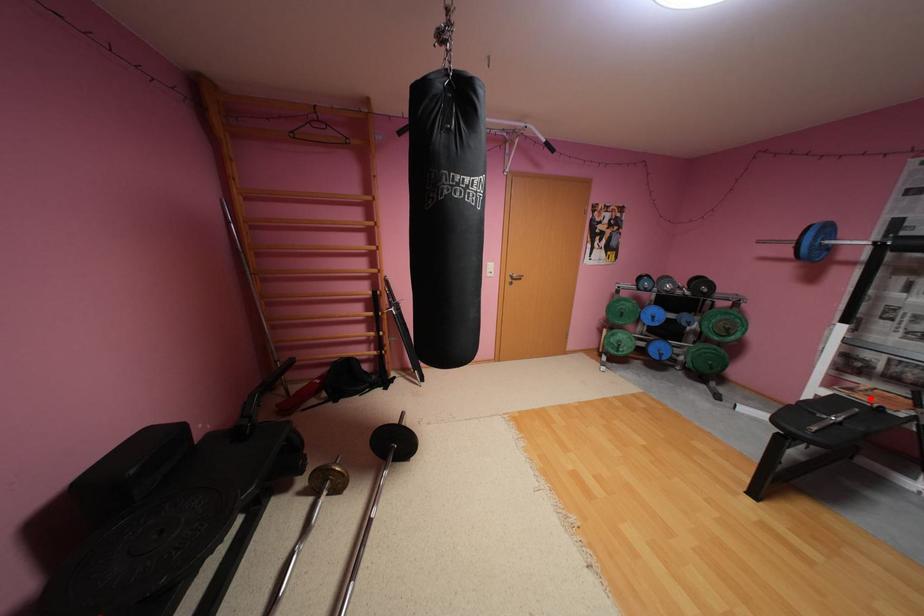
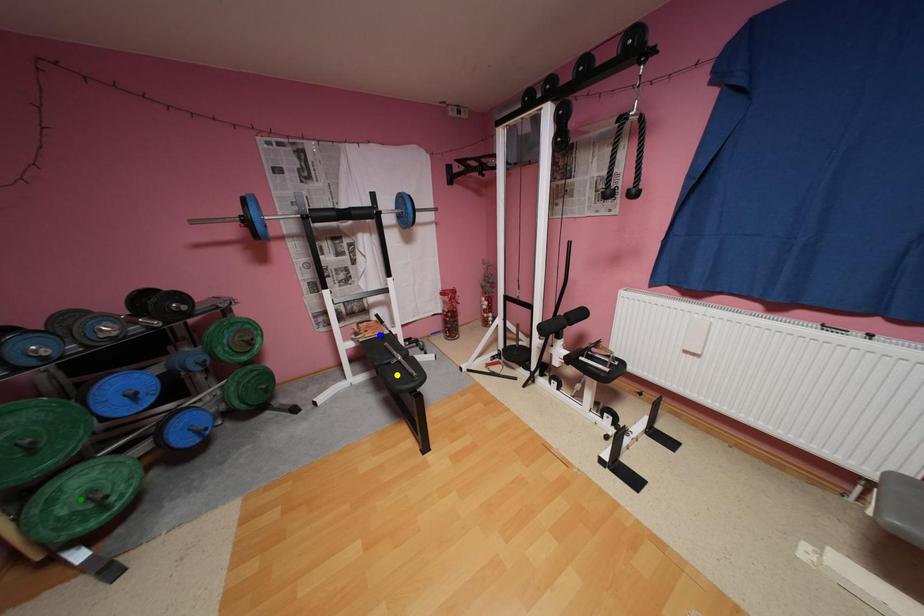
Question: I am providing you with two images of the same scene from different viewpoints. A red point is marked on the first image. You are given multiple points on the second image. Can you choose the point in image 2 that corresponds to the point in image 1?

Choices:
 (A) blue point
 (B) yellow point
 (C) green point

Answer: (A)